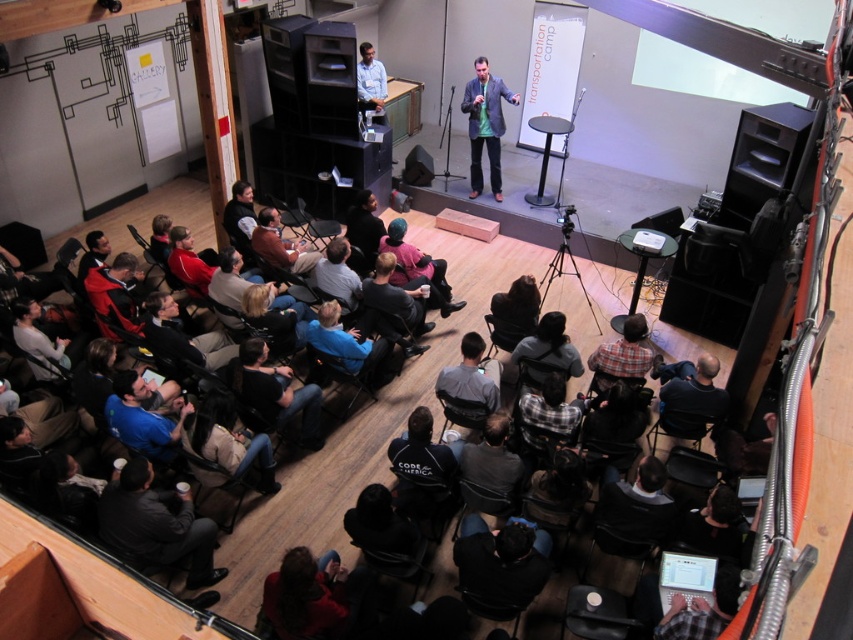
You are standing in the conference room and want to approach the point marked at coordinates point (325, 634). If your walking speed is 1.2 meters per second, how many seconds will it take you to reach that point?

The distance between you and the point (325, 634) is 3.32 meters. At a speed of 1.2 meters per second, it would take approximately 2.77 seconds to reach the point.

You are attending a conference and see the dark blue jeans at lower center and the dark brown leather jacket at center. Which one is smaller in size?

Answer: The dark blue jeans at lower center has a smaller size compared to the dark brown leather jacket at center.

You are an event organizer checking the seating arrangement. You notice two items on the stage at the front of the room. One is the dark blue jeans at lower center and the other is the matte gray sweater at lower left. Which of these items is bigger in size?

The dark blue jeans at lower center has a larger size compared to the matte gray sweater at lower left, so the dark blue jeans at lower center is bigger.